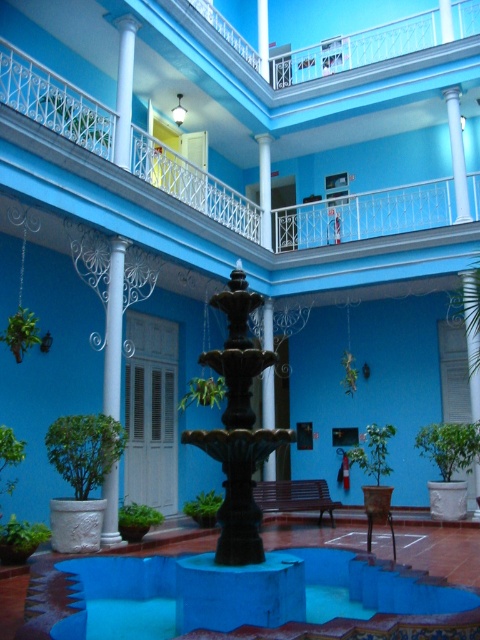
You are an interior designer planning to place a large sculpture in the courtyard. The sculpture requires a space larger than the white glossy pillar at center. Based on the scene, is the blue concrete fountain at center a suitable location for placing the sculpture?

The blue concrete fountain at center is bigger than the white glossy pillar at center, so it can accommodate the sculpture that requires a space larger than the white glossy pillar at center.

You are standing in the courtyard and want to place a decorative statue between the white glossy column at center and the black polished pillar at center. Which direction should you place it to ensure it sits between them?

The white glossy column at center is positioned over the black polished pillar at center, so placing the statue between them would require positioning it below the white glossy column at center and above the black polished pillar at center.

You are standing in the courtyard and want to locate the blue concrete fountain at center. According to the coordinates provided, where should you look?

The blue concrete fountain at center is located at coordinates point (372, 588).